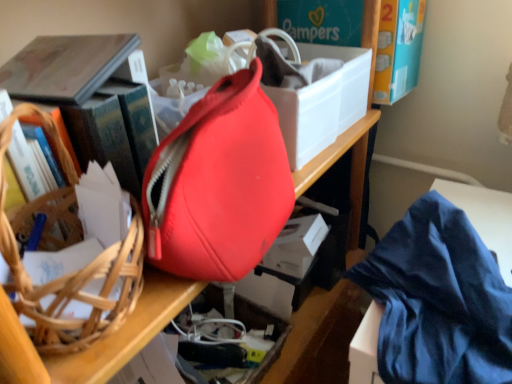
Question: From a real-world perspective, is brown woven basket at left physically above white matte storage box at center?

Choices:
 (A) yes
 (B) no

Answer: (A)

Question: Does brown woven basket at left have a greater width compared to white matte storage box at center?

Choices:
 (A) yes
 (B) no

Answer: (A)

Question: Is brown woven basket at left positioned in front of white matte storage box at center?

Choices:
 (A) yes
 (B) no

Answer: (A)

Question: Is brown woven basket at left not near white matte storage box at center?

Choices:
 (A) no
 (B) yes

Answer: (A)

Question: Does brown woven basket at left have a larger size compared to white matte storage box at center?

Choices:
 (A) yes
 (B) no

Answer: (A)

Question: From the image's perspective, relative to brown woven basket at left, is matte red bag at center above or below?

Choices:
 (A) below
 (B) above

Answer: (B)

Question: Is matte red bag at center inside the boundaries of brown woven basket at left, or outside?

Choices:
 (A) outside
 (B) inside

Answer: (A)

Question: Is point (236, 162) closer or farther from the camera than point (31, 291)?

Choices:
 (A) closer
 (B) farther

Answer: (B)

Question: Based on their positions, is matte red bag at center located to the left or right of brown woven basket at left?

Choices:
 (A) right
 (B) left

Answer: (A)

Question: Looking at the image, does blue silky cloth at lower right seem bigger or smaller compared to brown woven basket at left?

Choices:
 (A) small
 (B) big

Answer: (B)

Question: From a real-world perspective, is blue silky cloth at lower right physically located above or below brown woven basket at left?

Choices:
 (A) above
 (B) below

Answer: (B)

Question: Is blue silky cloth at lower right wider or thinner than brown woven basket at left?

Choices:
 (A) wide
 (B) thin

Answer: (A)

Question: In the image, is blue silky cloth at lower right positioned in front of or behind brown woven basket at left?

Choices:
 (A) behind
 (B) front

Answer: (A)

Question: In terms of size, does hardcover book at left appear bigger or smaller than matte red bag at center?

Choices:
 (A) small
 (B) big

Answer: (A)

Question: From the image's perspective, is hardcover book at left located above or below matte red bag at center?

Choices:
 (A) below
 (B) above

Answer: (B)